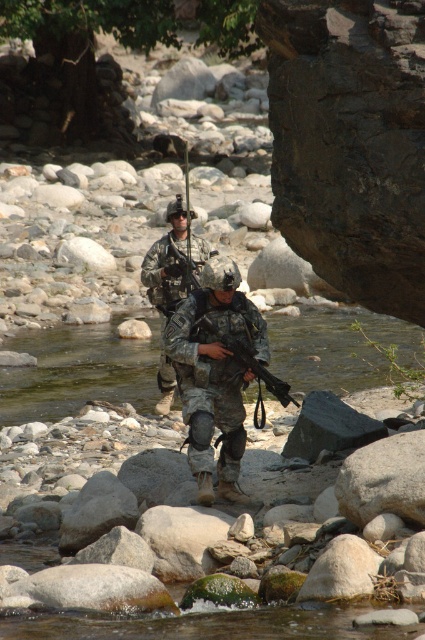
Question: Which of the following is the closest to the observer?

Choices:
 (A) (178, 296)
 (B) (220, 413)

Answer: (B)

Question: Is the position of camouflage fabric uniform at center more distant than that of camouflage uniform at center?

Choices:
 (A) no
 (B) yes

Answer: (A)

Question: Is camouflage fabric uniform at center smaller than camouflage uniform at center?

Choices:
 (A) yes
 (B) no

Answer: (A)

Question: Is camouflage fabric uniform at center bigger than camouflage uniform at center?

Choices:
 (A) no
 (B) yes

Answer: (A)